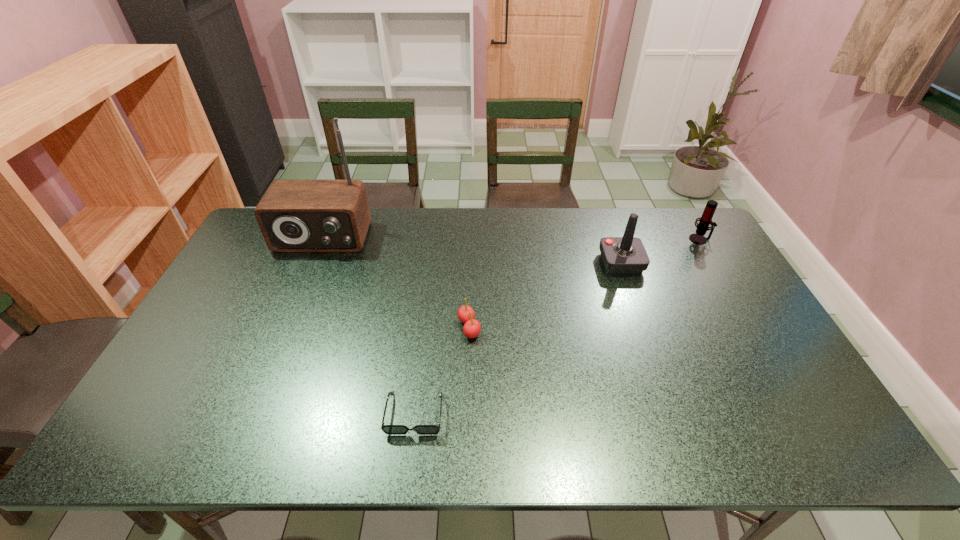
You are a GUI agent. You are given a task and a screenshot of the screen. Output one action in this format:
    pyautogui.click(x=<x>, y=<y>)
    Task: Click on the free spot that satisfies the following two spatial constraints: 1. on the back side of the fourth object from left to right; 2. on the left side of the third shortest object
    
    Given the screenshot: What is the action you would take?
    pyautogui.click(x=612, y=239)

Locate an element on the screen. vacant space that satisfies the following two spatial constraints: 1. on the front-facing side of the tallest object; 2. on the right side of the rightmost object is located at coordinates (322, 239).

This screenshot has width=960, height=540. What are the coordinates of `free space in the image that satisfies the following two spatial constraints: 1. on the front-facing side of the tallest object; 2. on the left side of the third object from right to left` in the screenshot? It's located at (284, 328).

Locate an element on the screen. The image size is (960, 540). free space that satisfies the following two spatial constraints: 1. on the front-facing side of the joystick; 2. on the right side of the leftmost object is located at coordinates (312, 263).

This screenshot has width=960, height=540. Identify the location of free point that satisfies the following two spatial constraints: 1. on the front-facing side of the leftmost object; 2. on the left side of the rightmost object. (322, 239).